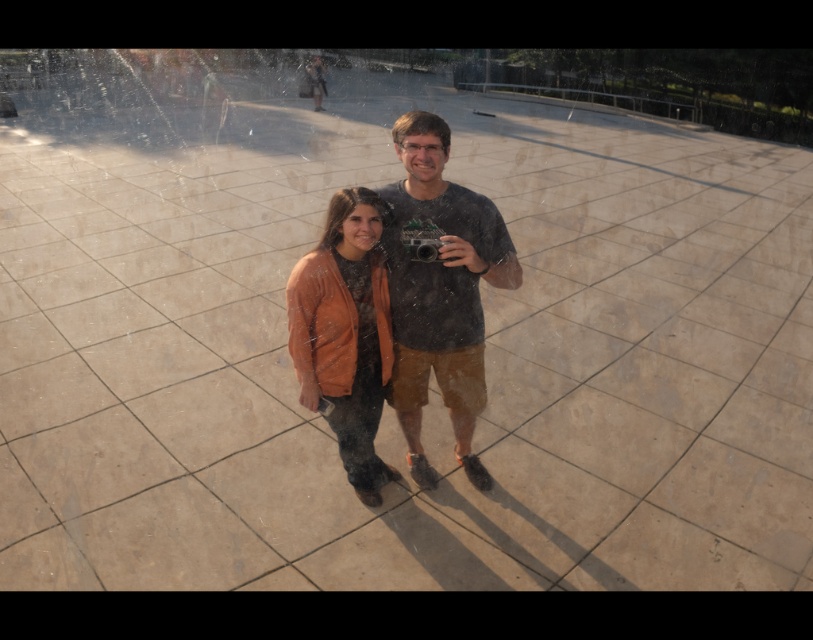
You are standing in the plaza and want to walk from point A to point B. Point A is at coordinate point (x=464, y=339) and point B is at coordinate point (x=353, y=458). Which point should you start walking from to reach the other point first?

You should start walking from point A at coordinate point (x=464, y=339) because it is closer to the viewer than point B at coordinate point (x=353, y=458), so you can reach point B first by starting from the closer point.